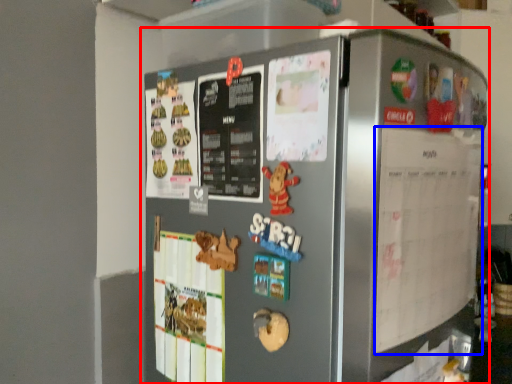
Question: Which of the following is the farthest to the observer, refrigerator (highlighted by a red box) or menu (highlighted by a blue box)?

Choices:
 (A) refrigerator
 (B) menu

Answer: (B)